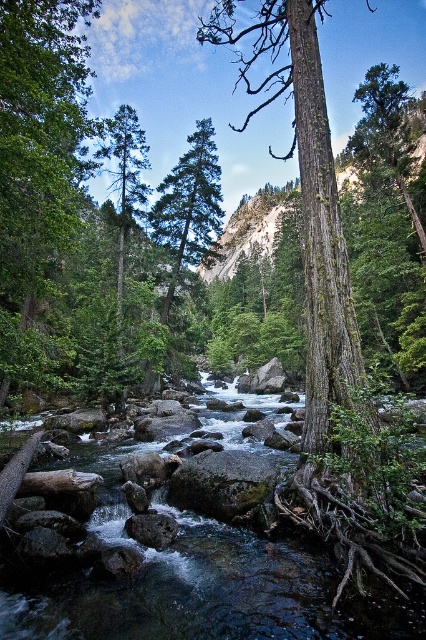
Can you confirm if green mossy tree at center is positioned above green matte tree at center?

Yes.

Which is behind, point (259, 58) or point (170, 218)?

Positioned behind is point (259, 58).

Where is `green mossy tree at center`? The width and height of the screenshot is (426, 640). green mossy tree at center is located at coordinates (307, 198).

Does green mossy tree at center have a greater height compared to gray smooth rock at center?

Indeed, green mossy tree at center has a greater height compared to gray smooth rock at center.

Identify the location of green mossy tree at center. The image size is (426, 640). (307, 198).

I want to click on green mossy tree at center, so click(307, 198).

Who is lower down, green mossy rock at center or gray smooth rock at center?

gray smooth rock at center

The image size is (426, 640). Find the location of `green mossy rock at center`. green mossy rock at center is located at coordinates (221, 483).